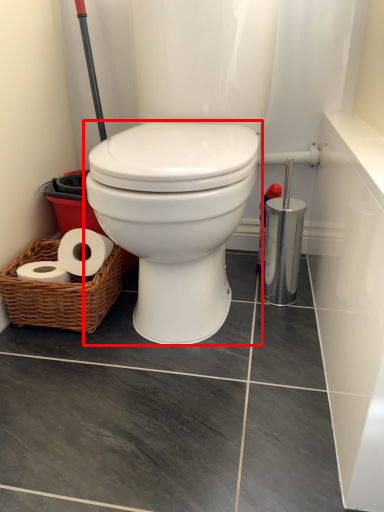
Question: From the image's perspective, considering the relative positions of toilet (annotated by the red box) and basket in the image provided, where is toilet (annotated by the red box) located with respect to the staircase?

Choices:
 (A) above
 (B) below

Answer: (A)